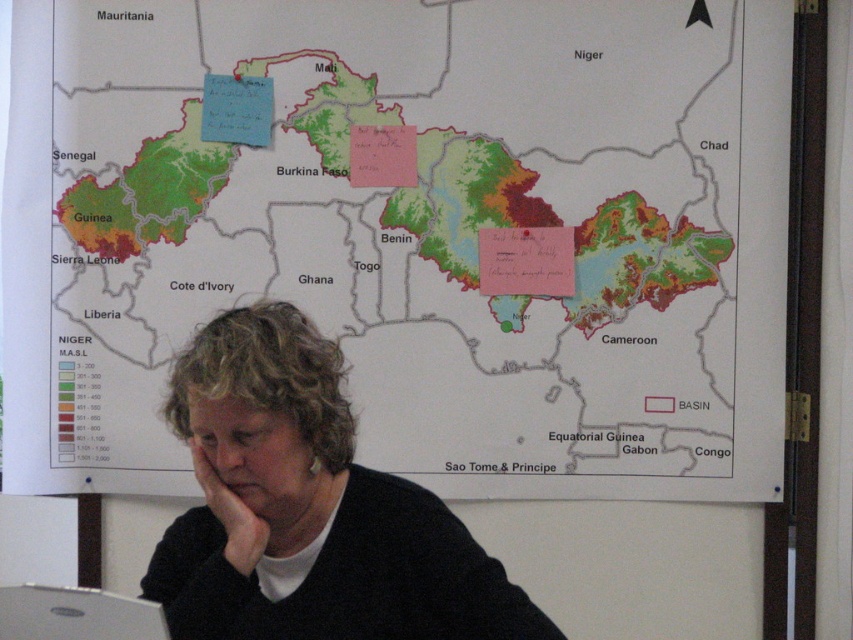
You are a student who needs to place a 15 cm wide notebook on the desk in front of the large map of West Africa. The desk has the black sweater at lower center and the silver metallic laptop at lower left. Can the notebook fit between these two items?

The black sweater at lower center has a larger size compared to the silver metallic laptop at lower left. Since the sweater is larger, there might not be enough space between them to fit a 15 cm wide notebook. Check the actual distance between them first.

You are a student trying to place a notebook between the black sweater at lower center and the silver metallic laptop at lower left. Can you fit it there?

The black sweater at lower center is wider than the silver metallic laptop at lower left. Since the sweater is wider, there might not be enough space between them to fit the notebook unless the laptop is moved closer. However, the exact distance isn